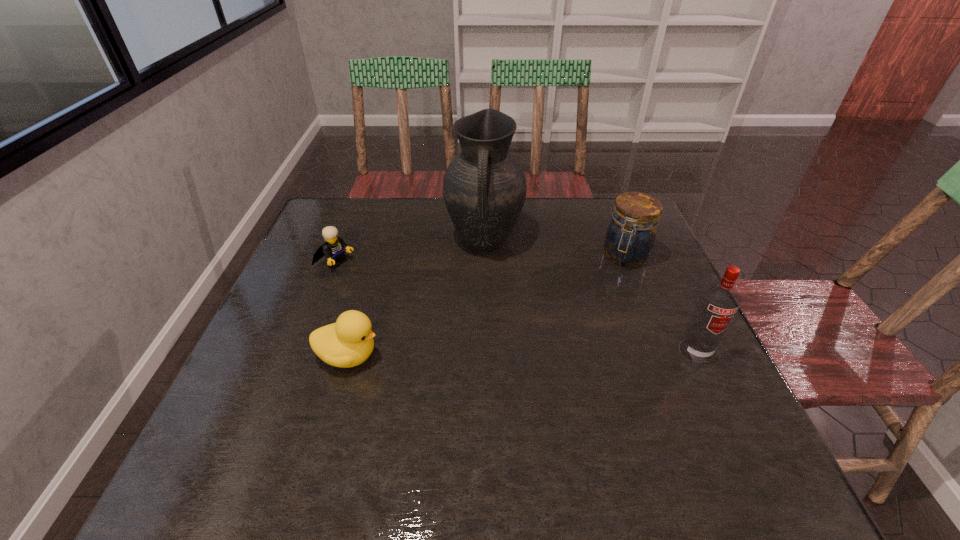
The width and height of the screenshot is (960, 540). I want to click on vacant space in between the tallest object and the fourth shortest object, so click(x=589, y=296).

Find the location of a particular element. The height and width of the screenshot is (540, 960). vacant space that's between the vodka and the jar is located at coordinates (660, 303).

Where is `blank region between the Lego and the tallest object`? This screenshot has height=540, width=960. blank region between the Lego and the tallest object is located at coordinates (410, 251).

Where is `empty location between the third tallest object and the duck`? The width and height of the screenshot is (960, 540). empty location between the third tallest object and the duck is located at coordinates (487, 306).

Find the location of a particular element. This screenshot has width=960, height=540. vacant space in between the second tallest object and the third object from left to right is located at coordinates (589, 296).

Image resolution: width=960 pixels, height=540 pixels. What are the coordinates of `blank region between the third shortest object and the Lego` in the screenshot? It's located at coord(481,258).

Find the location of a particular element. empty space that is in between the Lego and the third object from right to left is located at coordinates (410, 251).

In order to click on free space between the pitcher and the Lego in this screenshot , I will do `click(410, 251)`.

In order to click on object that is the third closest one to the tallest object in this screenshot , I will do tap(349, 342).

Image resolution: width=960 pixels, height=540 pixels. I want to click on object that is the fourth closest to the vodka, so (333, 249).